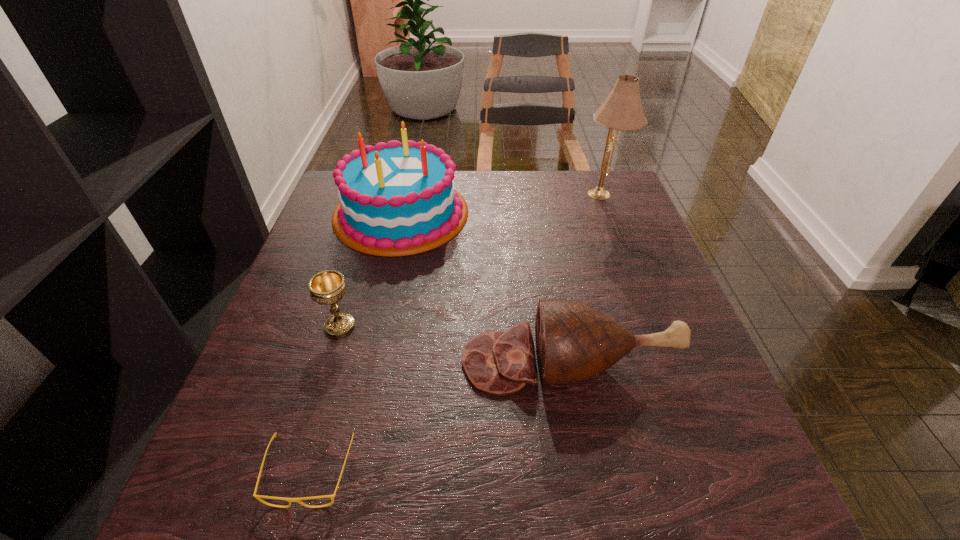
This screenshot has width=960, height=540. In order to click on vacant area between the ham and the chalice in this screenshot , I will do `click(455, 343)`.

I want to click on blank region between the second tallest object and the chalice, so click(371, 269).

Where is `free space between the nearest object and the tallest object`? Image resolution: width=960 pixels, height=540 pixels. free space between the nearest object and the tallest object is located at coordinates tap(457, 334).

Find the location of `vacant region between the nearest object and the birthday cake`. vacant region between the nearest object and the birthday cake is located at coordinates (355, 343).

The image size is (960, 540). In order to click on free space that is in between the tallest object and the ham in this screenshot , I will do `click(587, 278)`.

The width and height of the screenshot is (960, 540). What are the coordinates of `free space between the ham and the lampshade` in the screenshot? It's located at (587, 278).

Where is `empty space between the nearest object and the chalice`? This screenshot has width=960, height=540. empty space between the nearest object and the chalice is located at coordinates (324, 400).

Identify the location of vacant space that's between the second tallest object and the nearest object. (355, 343).

Identify the location of vacant region between the chalice and the second tallest object. (371, 269).

Select which object appears as the second closest to the second tallest object. Please provide its 2D coordinates. Your answer should be formatted as a tuple, i.e. [(x, y)], where the tuple contains the x and y coordinates of a point satisfying the conditions above.

[(574, 341)]